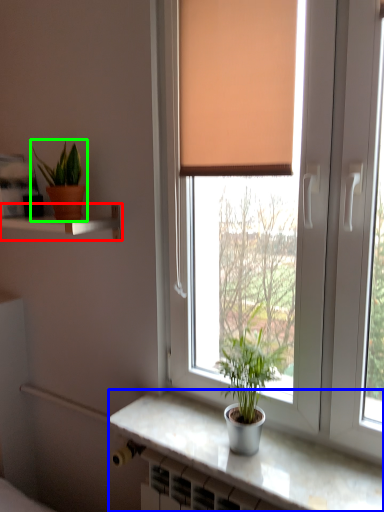
Question: Based on their relative distances, which object is farther from shelf (highlighted by a red box)? Choose from counter top (highlighted by a blue box) and houseplant (highlighted by a green box).

Choices:
 (A) counter top
 (B) houseplant

Answer: (A)